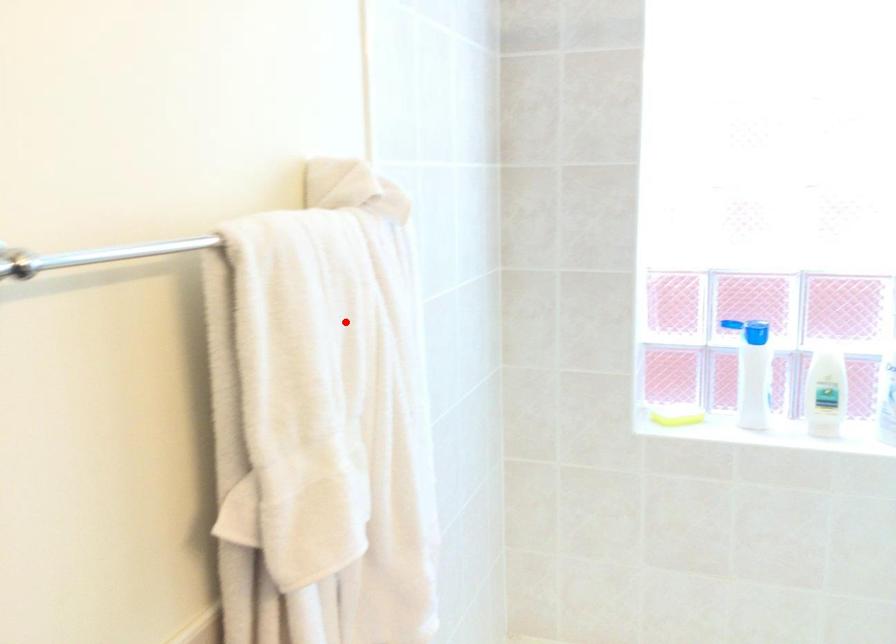
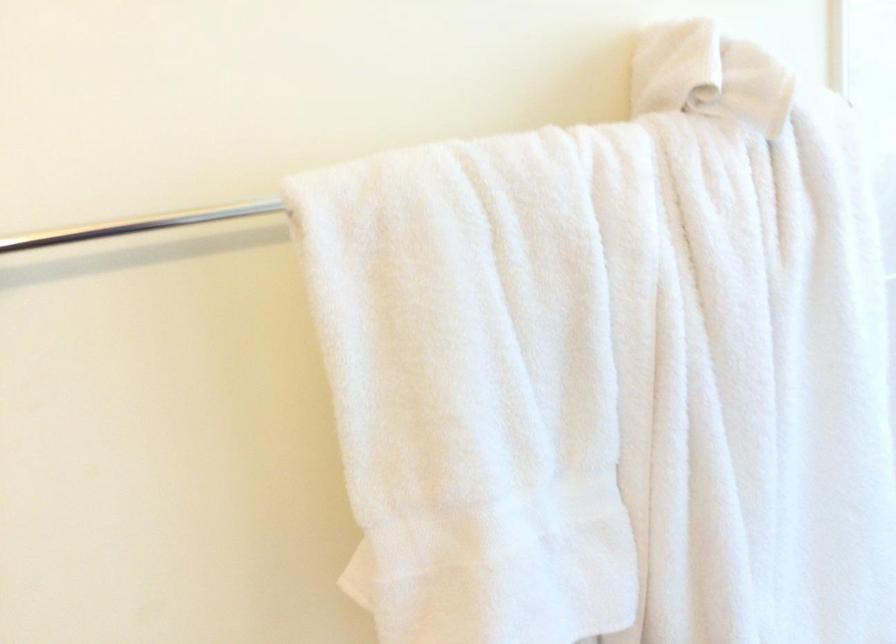
The point at the highlighted location is marked in the first image. Where is the corresponding point in the second image?

(607, 344)